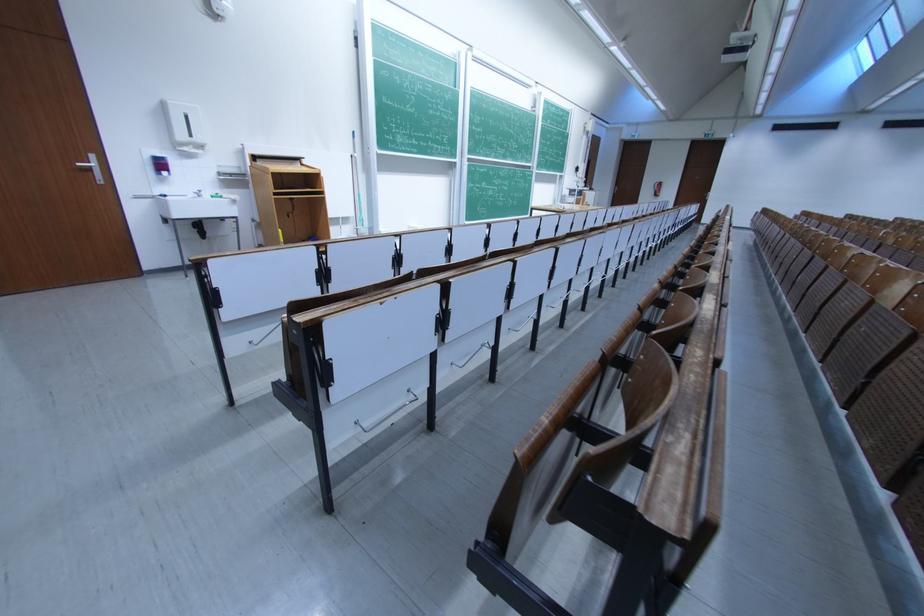
Find where to push the white wall dispenser. Please return your answer as a coordinate pair (x, y).

(185, 126)